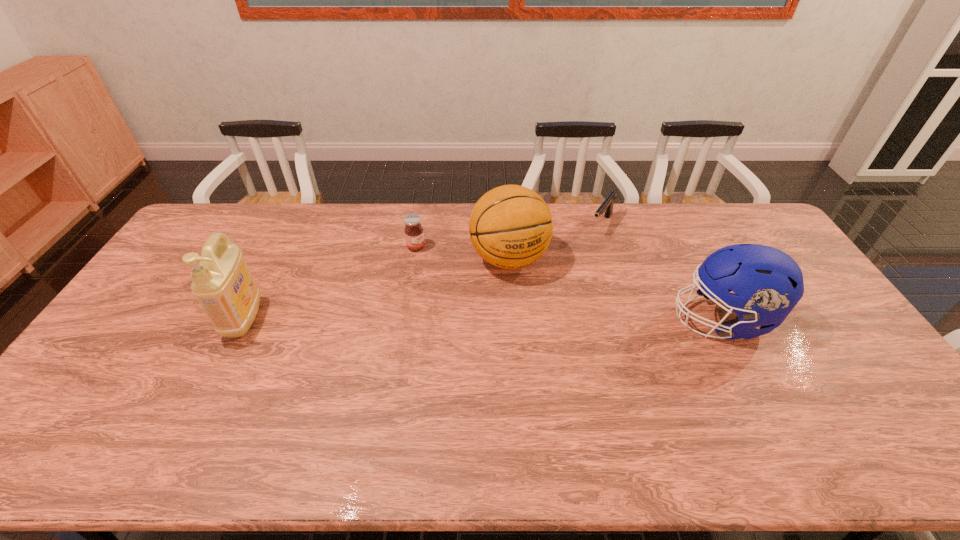
Where is `detergent`? The width and height of the screenshot is (960, 540). detergent is located at coordinates (222, 283).

Identify the location of the rightmost object. This screenshot has height=540, width=960. (768, 283).

Find the location of a particular element. The height and width of the screenshot is (540, 960). jam is located at coordinates (414, 234).

What are the coordinates of `the third object from right to left` in the screenshot? It's located at (510, 226).

Locate an element on the screen. Image resolution: width=960 pixels, height=540 pixels. the second object from right to left is located at coordinates [x=606, y=207].

The image size is (960, 540). I want to click on vacant region located on the right of the detergent, so click(x=279, y=319).

You are a GUI agent. You are given a task and a screenshot of the screen. Output one action in this format:
    pyautogui.click(x=<x>, y=<y>)
    Task: Click on the free location located on the front-facing side of the rightmost object
    The height and width of the screenshot is (540, 960).
    Given the screenshot: What is the action you would take?
    pyautogui.click(x=615, y=319)

Find the location of a particular element. The height and width of the screenshot is (540, 960). free space located on the front-facing side of the rightmost object is located at coordinates (534, 319).

This screenshot has height=540, width=960. Identify the location of blank area located on the front-facing side of the rightmost object. (612, 319).

You are a GUI agent. You are given a task and a screenshot of the screen. Output one action in this format:
    pyautogui.click(x=<x>, y=<y>)
    Task: Click on the vacant space located on the label side of the second object from left to right
    The width and height of the screenshot is (960, 540).
    Given the screenshot: What is the action you would take?
    pyautogui.click(x=500, y=297)